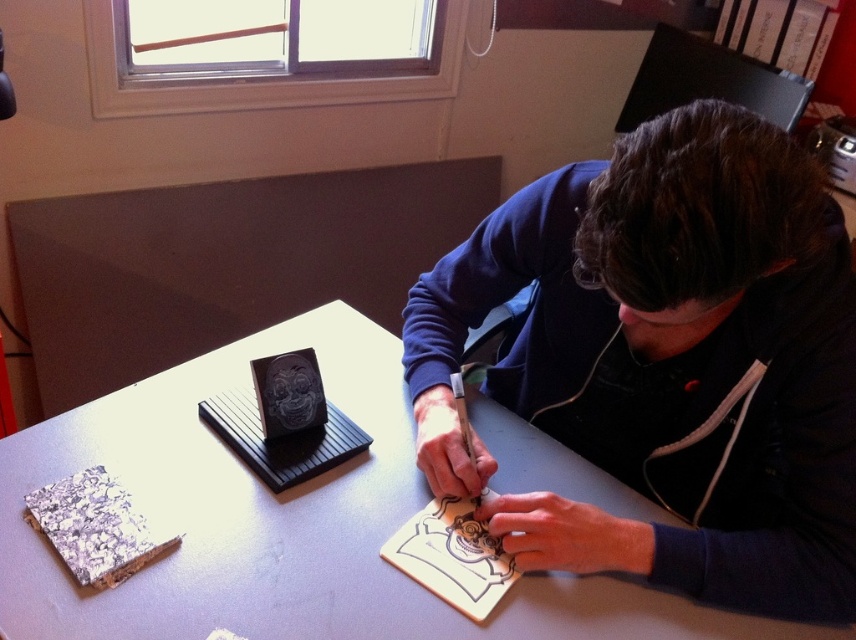
Can you confirm if dark blue hoodie at center is positioned above white matte table at center?

Yes.

Does dark blue hoodie at center have a lesser width compared to white matte table at center?

Correct, dark blue hoodie at center's width is less than white matte table at center's.

Does point (596, 353) come behind point (413, 493)?

Yes, it is.

Find the location of a particular element. The width and height of the screenshot is (856, 640). dark blue hoodie at center is located at coordinates (667, 362).